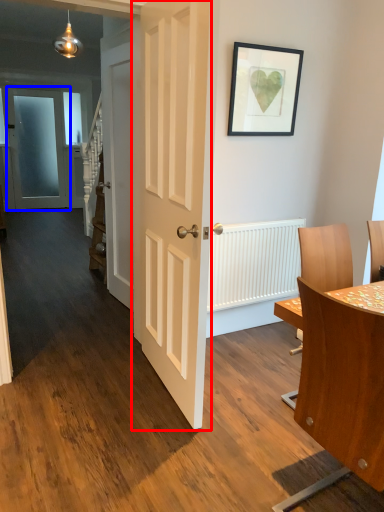
Question: Which object is closer to the camera taking this photo, door (highlighted by a red box) or door (highlighted by a blue box)?

Choices:
 (A) door
 (B) door

Answer: (A)